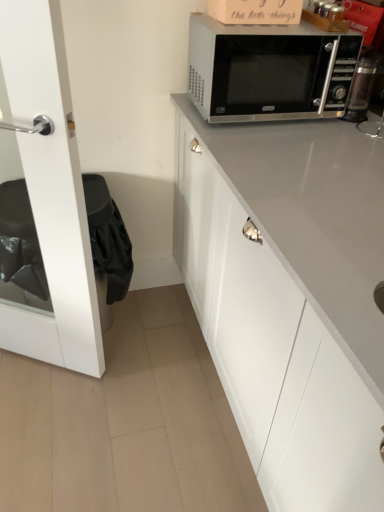
Locate an element on the screen. The width and height of the screenshot is (384, 512). vacant point to the right of white glossy door at left is located at coordinates (129, 380).